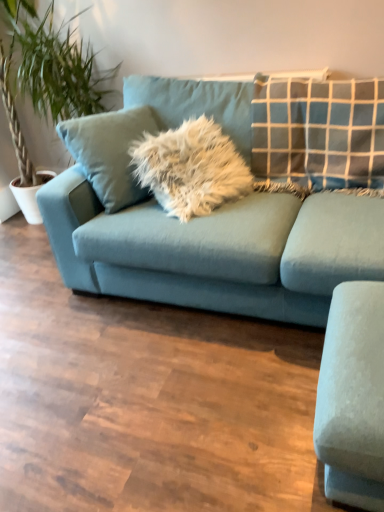
Question: Does white ceramic pot at left have a lesser width compared to matte blue couch at center?

Choices:
 (A) no
 (B) yes

Answer: (B)

Question: Is white ceramic pot at left directly adjacent to matte blue couch at center?

Choices:
 (A) yes
 (B) no

Answer: (B)

Question: Is white ceramic pot at left bigger than matte blue couch at center?

Choices:
 (A) yes
 (B) no

Answer: (B)

Question: Is white ceramic pot at left to the left of matte blue couch at center from the viewer's perspective?

Choices:
 (A) no
 (B) yes

Answer: (B)

Question: From a real-world perspective, is white ceramic pot at left located beneath matte blue couch at center?

Choices:
 (A) no
 (B) yes

Answer: (B)

Question: From the image's perspective, is green leafy plant at left positioned above or below white ceramic pot at left?

Choices:
 (A) below
 (B) above

Answer: (B)

Question: In the image, is green leafy plant at left on the left side or the right side of white ceramic pot at left?

Choices:
 (A) right
 (B) left

Answer: (A)

Question: Do you think green leafy plant at left is within white ceramic pot at left, or outside of it?

Choices:
 (A) inside
 (B) outside

Answer: (B)

Question: Considering the positions of green leafy plant at left and white ceramic pot at left in the image, is green leafy plant at left taller or shorter than white ceramic pot at left?

Choices:
 (A) tall
 (B) short

Answer: (A)

Question: Would you say white ceramic pot at left is to the left or to the right of matte blue couch at center in the picture?

Choices:
 (A) left
 (B) right

Answer: (A)

Question: From their relative heights in the image, would you say white ceramic pot at left is taller or shorter than matte blue couch at center?

Choices:
 (A) tall
 (B) short

Answer: (B)

Question: Looking at their shapes, would you say white ceramic pot at left is wider or thinner than matte blue couch at center?

Choices:
 (A) wide
 (B) thin

Answer: (B)

Question: From a real-world perspective, relative to matte blue couch at center, is white ceramic pot at left vertically above or below?

Choices:
 (A) above
 (B) below

Answer: (B)

Question: From a real-world perspective, is matte blue couch at center physically located above or below white ceramic pot at left?

Choices:
 (A) below
 (B) above

Answer: (B)

Question: In the image, is matte blue couch at center positioned in front of or behind white ceramic pot at left?

Choices:
 (A) behind
 (B) front

Answer: (B)